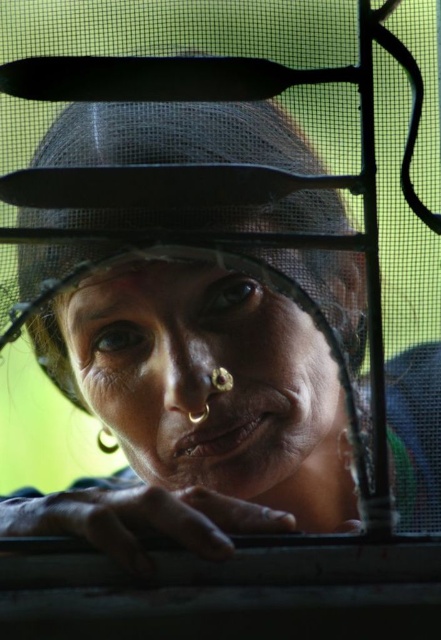
Based on the photo, you are a photographer adjusting the focus on your camera. The subject has a matte skin face at center and a matte black hat at center. Which object is closer to the camera lens?

The matte skin face at center is closer to the camera lens because it is only 2.22 inches away from the matte black hat at center, which is farther away.

You are a photographer trying to capture a portrait of the woman with her matte skin face at center and matte black hat at center. The camera can only focus on objects wider than 10 cm. Which object should you focus on to ensure it is in focus?

The matte black hat at center is wider than the matte skin face at center, so you should focus on the matte black hat at center to ensure it is in focus since it meets the camera requirement of being wider than 10 cm.

You are a photographer trying to capture a clear portrait of the woman. The matte skin face at center and the matte black hat at center are both in your viewfinder. Which object should you focus on to ensure the woman is sharp and the hat is slightly out of focus?

You should focus on the matte skin face at center because the matte black hat at center is behind it, so focusing on the face will keep it sharp while the hat remains slightly out of focus.